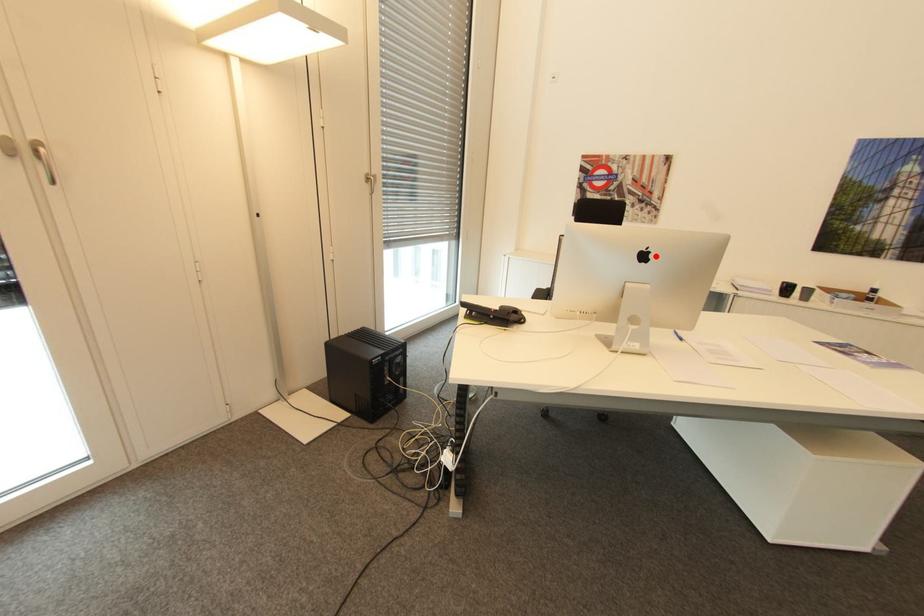
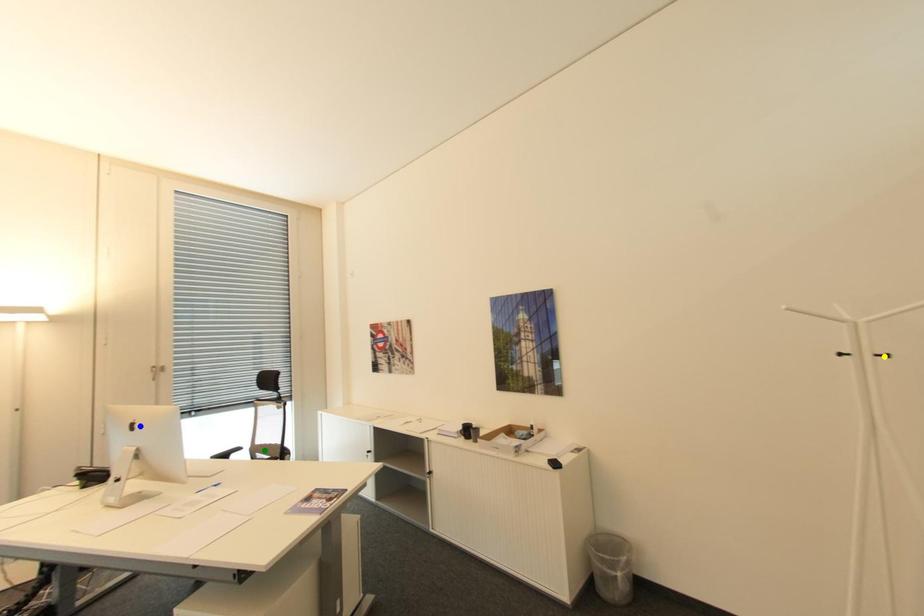
Question: I am providing you with two images of the same scene from different viewpoints. A red point is marked on the first image. You are given multiple points on the second image. Which point in image 2 represents the same 3d spot as the red point in image 1?

Choices:
 (A) blue point
 (B) yellow point
 (C) green point

Answer: (A)